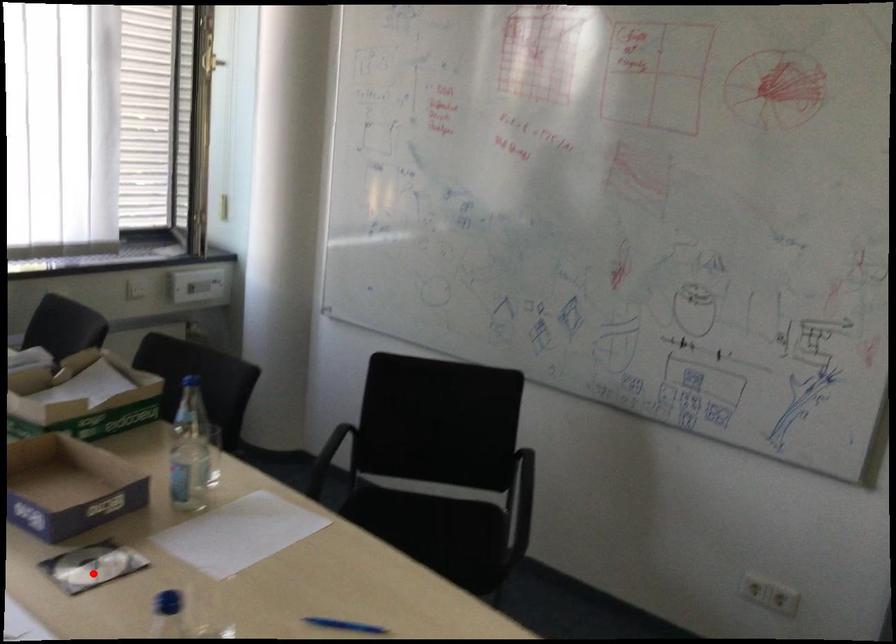
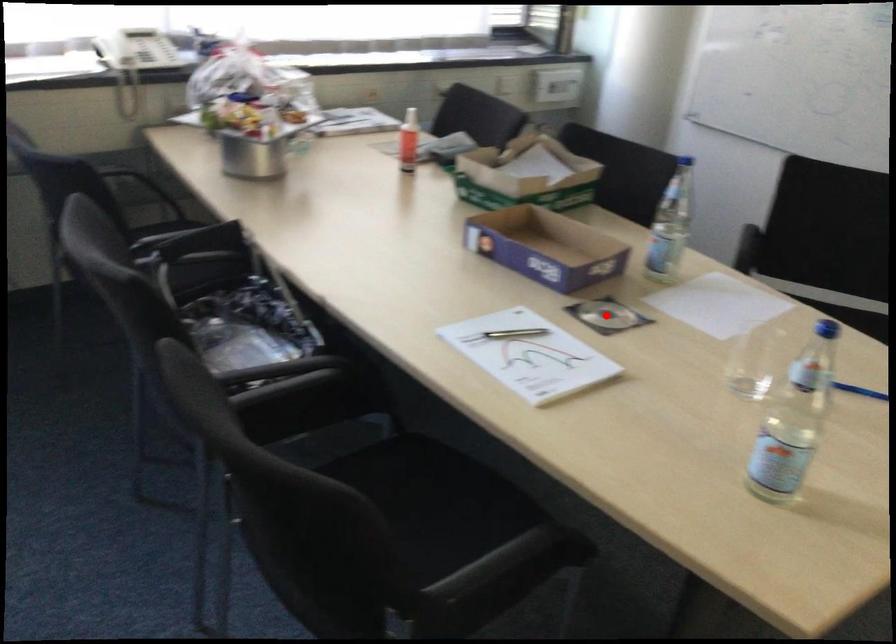
I am providing you with two images of the same scene from different viewpoints. A red point is marked on the first image and another point is marked on the second image. Do the highlighted points in image1 and image2 indicate the same real-world spot?

Yes